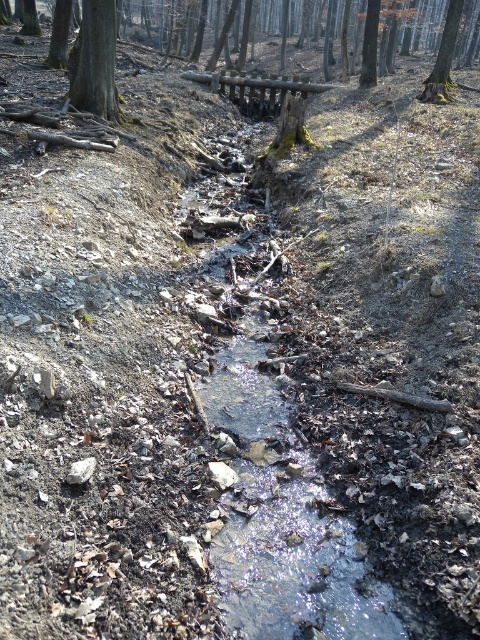
You are a hiker who needs to cross the stream and wants to place a 20 feet long floating log between the smooth brown tree trunk at upper left and the green mossy tree at upper center. Will this log be long enough to bridge the gap between them?

The smooth brown tree trunk at upper left and green mossy tree at upper center are 24.37 feet apart from each other. The 20 feet long log is shorter than the required distance, so it will not be long enough to bridge the gap between them.

You are a hiker standing at the edge of the stream. You notice two trees in the upper part of the image. Which tree is positioned to the left of the other? The smooth brown tree trunk at upper left or the green mossy tree at upper center?

The smooth brown tree trunk at upper left is positioned to the left of the green mossy tree at upper center.